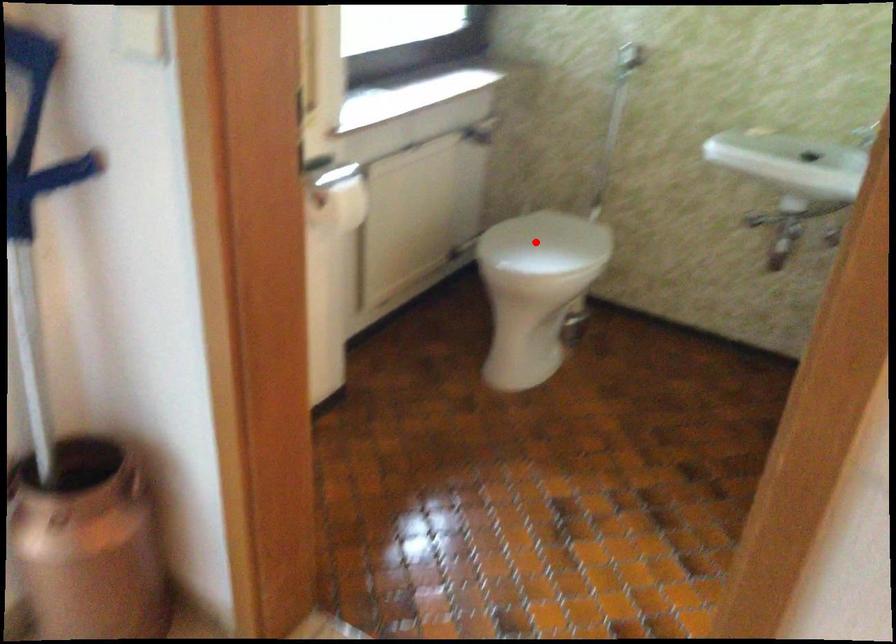
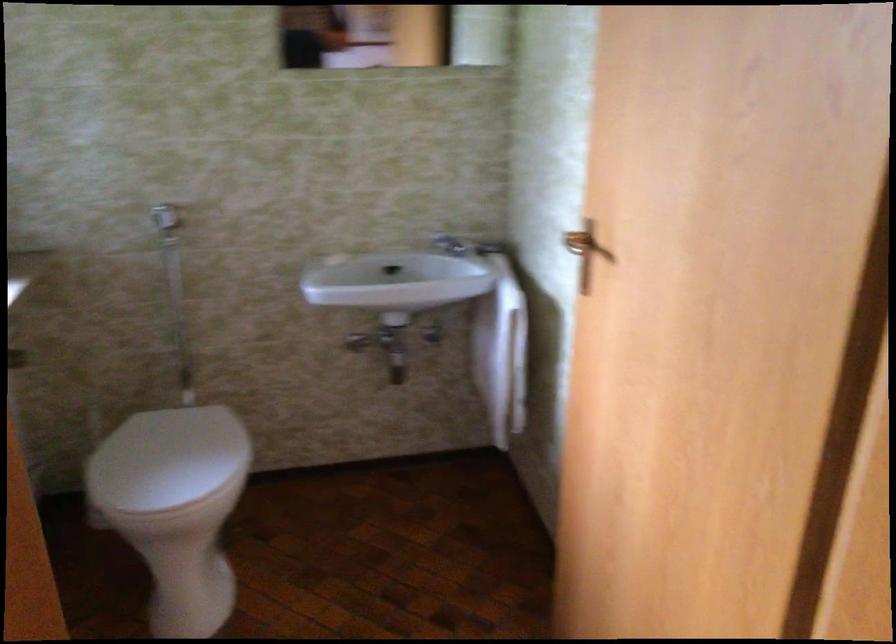
Locate, in the second image, the point that corresponds to the highlighted location in the first image.

(167, 460)